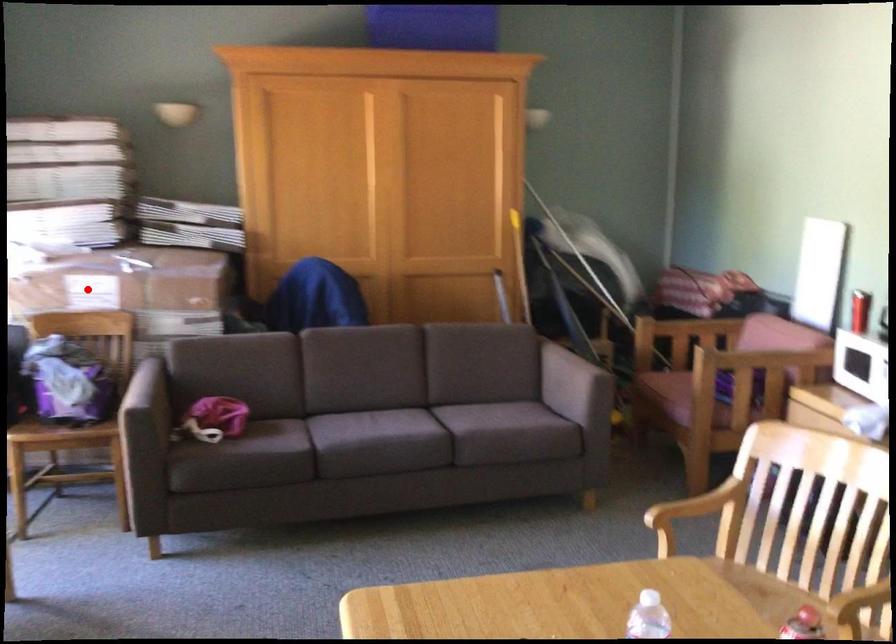
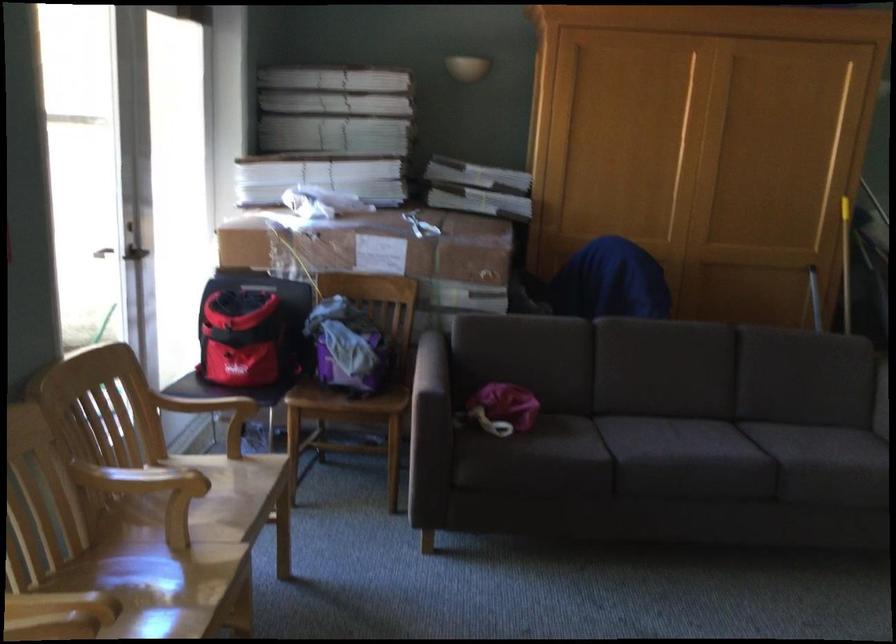
Question: I am providing you with two images of the same scene from different viewpoints. Given a red point in image1, look at the same physical point in image2. Is it:

Choices:
 (A) Closer to the viewpoint
 (B) Farther from the viewpoint

Answer: (A)